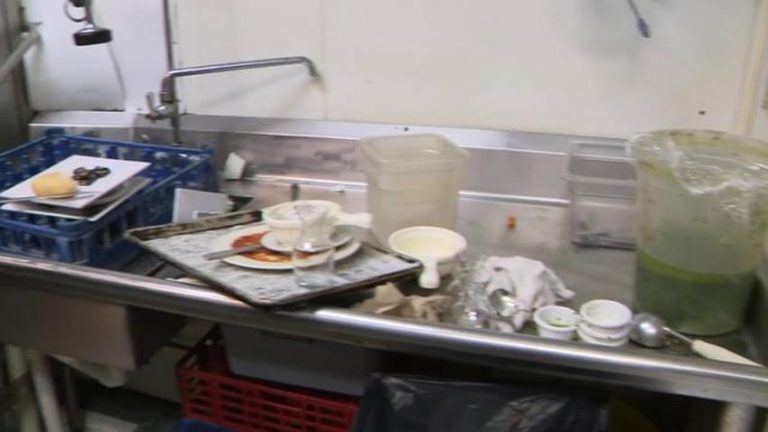
Locate an element on the screen. This screenshot has width=768, height=432. plate is located at coordinates (256, 252), (94, 190), (106, 207).